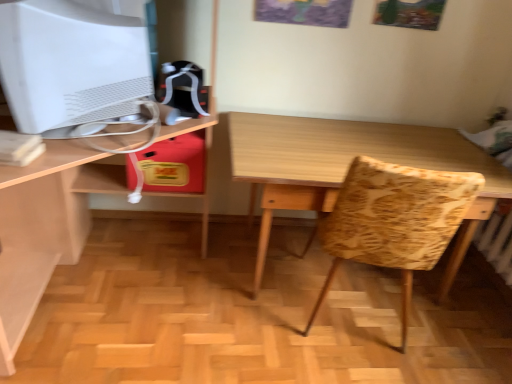
Question: Relative to wooden table at center, is wooden desk at center in front or behind?

Choices:
 (A) behind
 (B) front

Answer: (B)

Question: From the image's perspective, is wooden desk at center located above or below wooden table at center?

Choices:
 (A) below
 (B) above

Answer: (B)

Question: Which object is the farthest from the patterned fabric swivel chair at center?

Choices:
 (A) wooden table at center
 (B) wooden desk at center
 (C) white matte computer monitor at upper left

Answer: (B)

Question: Estimate the real-world distances between objects in this image. Which object is farther from the wooden table at center?

Choices:
 (A) white matte computer monitor at upper left
 (B) patterned fabric swivel chair at center
 (C) wooden desk at center

Answer: (C)